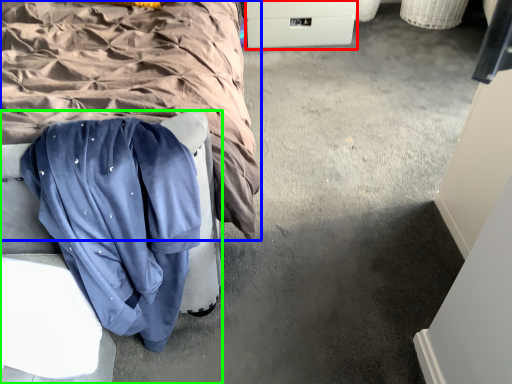
Question: Which object is positioned farthest from drawer (highlighted by a red box)? Select from bed (highlighted by a blue box) and furniture (highlighted by a green box).

Choices:
 (A) bed
 (B) furniture

Answer: (B)